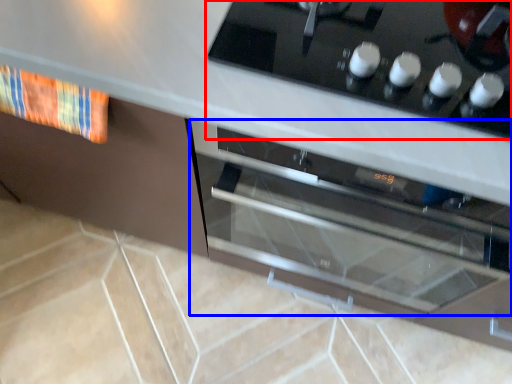
Question: Among these objects, which one is farthest to the camera, home appliance (highlighted by a red box) or oven (highlighted by a blue box)?

Choices:
 (A) home appliance
 (B) oven

Answer: (B)